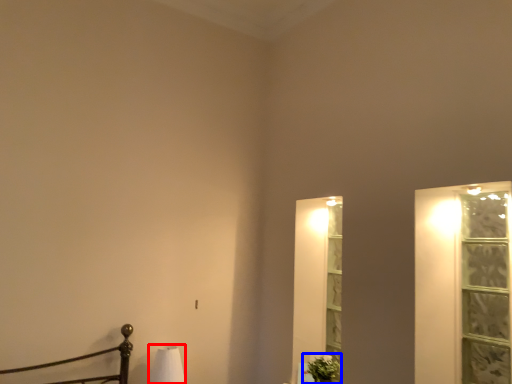
Question: Which of the following is the closest to the observer, table lamp (highlighted by a red box) or plant (highlighted by a blue box)?

Choices:
 (A) table lamp
 (B) plant

Answer: (A)